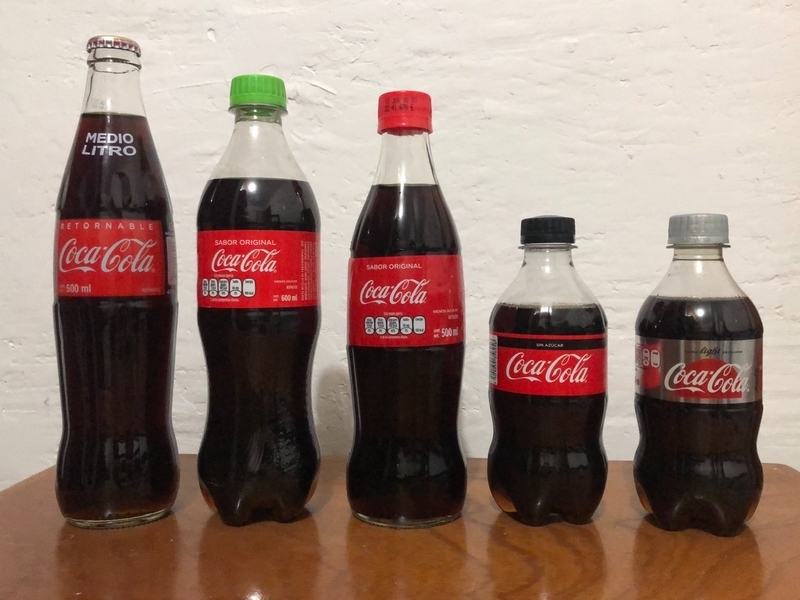
At what (x,y) coordinates should I click in order to perform the action: click on bottle. Please return your answer as a coordinate pair (x, y). Looking at the image, I should click on (120, 230), (244, 218), (416, 244), (582, 353), (694, 350).